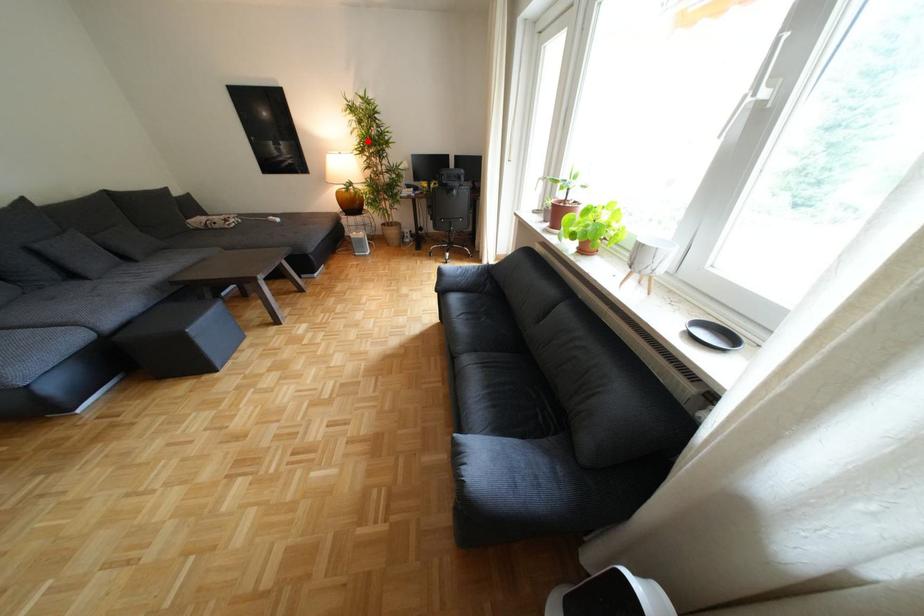
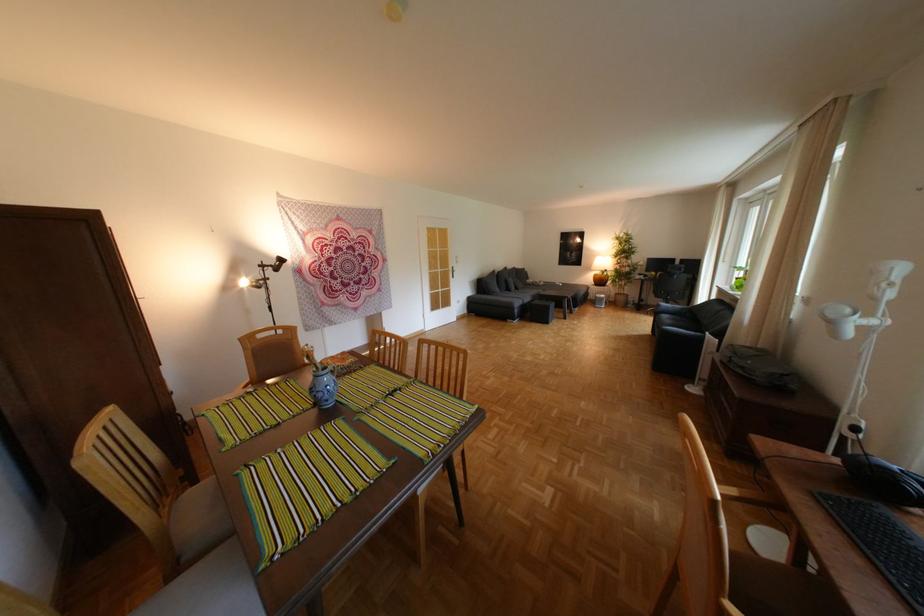
The point at the highlighted location is marked in the first image. Where is the corresponding point in the second image?

(626, 252)